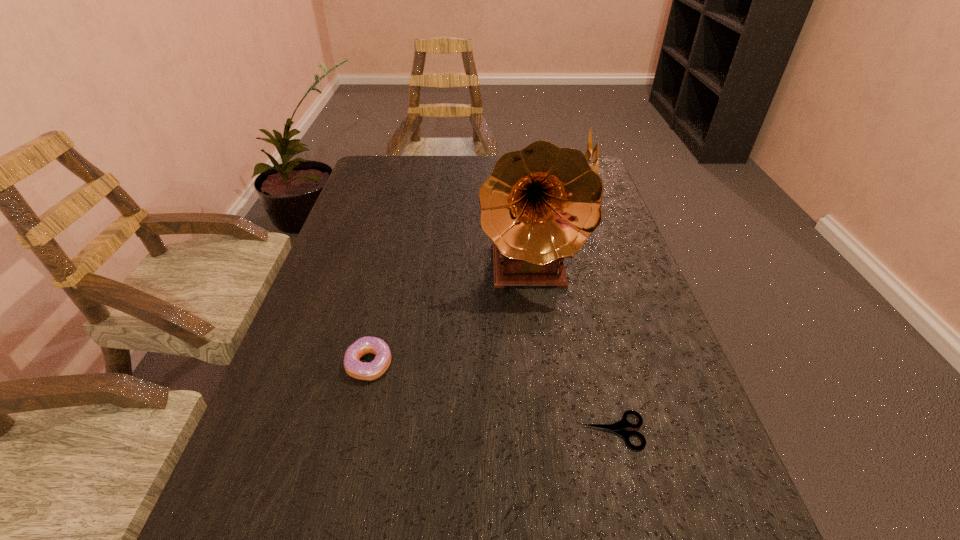
Where is `free space located on the front-facing side of the farthest object`? Image resolution: width=960 pixels, height=540 pixels. free space located on the front-facing side of the farthest object is located at coordinates (528, 185).

The height and width of the screenshot is (540, 960). Find the location of `vacant area located on the front-facing side of the farthest object`. vacant area located on the front-facing side of the farthest object is located at coordinates (515, 185).

At what (x,y) coordinates should I click in order to perform the action: click on vacant space situated on the back of the second shortest object. Please return your answer as a coordinate pair (x, y). This screenshot has width=960, height=540. Looking at the image, I should click on (396, 249).

The image size is (960, 540). Identify the location of free space located on the front of the nearest object. tap(635, 517).

Image resolution: width=960 pixels, height=540 pixels. Identify the location of object at the far edge. (594, 153).

This screenshot has height=540, width=960. Identify the location of object present at the left edge. (376, 368).

This screenshot has width=960, height=540. Identify the location of phonograph_record positioned at the right edge. (540, 204).

Find the location of a particular element. The height and width of the screenshot is (540, 960). earphone at the right edge is located at coordinates tap(594, 153).

This screenshot has width=960, height=540. Identify the location of shears that is at the right edge. pyautogui.click(x=618, y=427).

Locate an element on the screen. object located in the far right corner section of the desktop is located at coordinates (594, 153).